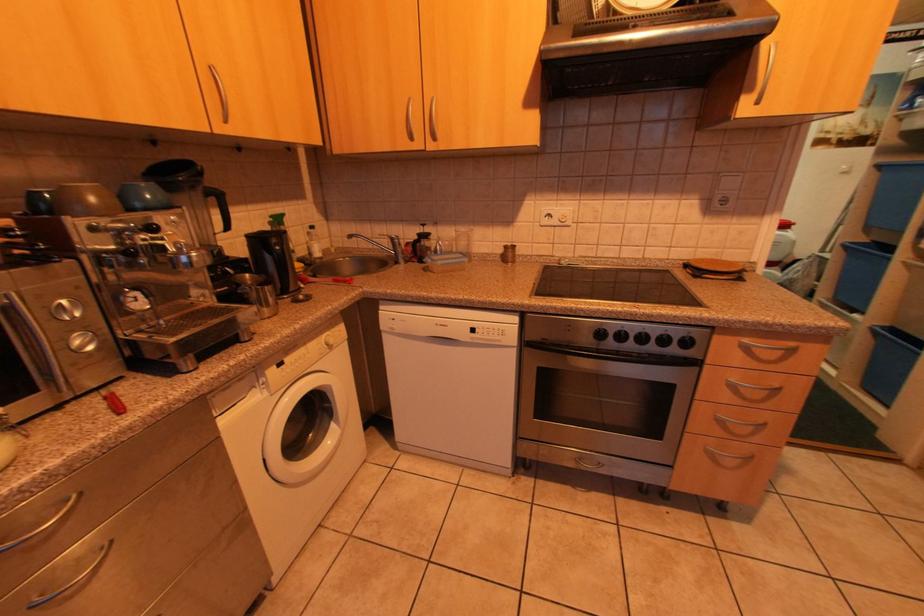
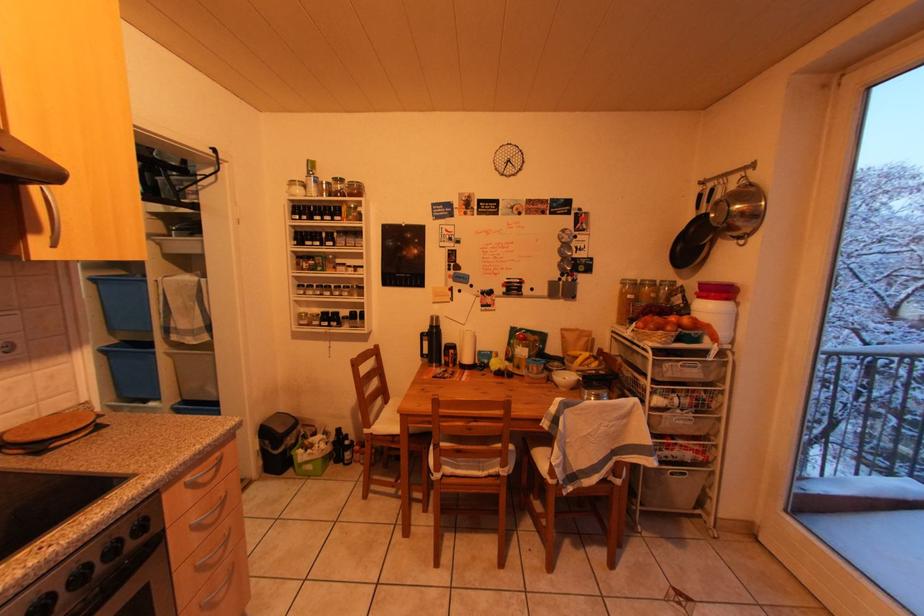
Question: The camera is either moving clockwise (left) or counter-clockwise (right) around the object. The first image is from the beginning of the video and the second image is from the end. Is the camera moving left or right when shooting the video?

Choices:
 (A) Left
 (B) Right

Answer: (A)